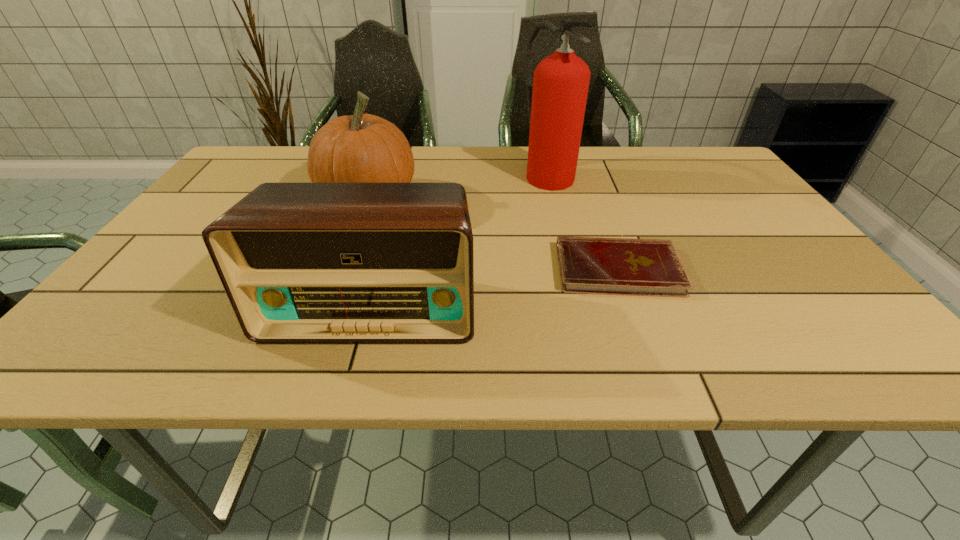
Locate an element on the screen. The image size is (960, 540). empty space that is in between the shortest object and the fire extinguisher is located at coordinates (583, 221).

Find the location of `free space between the shortest object and the tallest object`. free space between the shortest object and the tallest object is located at coordinates (583, 221).

You are a GUI agent. You are given a task and a screenshot of the screen. Output one action in this format:
    pyautogui.click(x=<x>, y=<y>)
    Task: Click on the closest object relative to the tallest object
    
    Given the screenshot: What is the action you would take?
    pyautogui.click(x=588, y=265)

Identify the location of object that ranks as the closest to the pumpkin. This screenshot has width=960, height=540. (300, 262).

Locate an element on the screen. Image resolution: width=960 pixels, height=540 pixels. vacant point that satisfies the following two spatial constraints: 1. on the stem of the pumpkin; 2. on the left side of the notebook is located at coordinates (344, 269).

Locate an element on the screen. The height and width of the screenshot is (540, 960). free space that satisfies the following two spatial constraints: 1. on the stem of the shortest object; 2. on the left side of the pumpkin is located at coordinates (344, 269).

You are a GUI agent. You are given a task and a screenshot of the screen. Output one action in this format:
    pyautogui.click(x=<x>, y=<y>)
    Task: Click on the free location that satisfies the following two spatial constraints: 1. on the handle side of the notebook; 2. on the right side of the fire extinguisher
    Image resolution: width=960 pixels, height=540 pixels.
    Given the screenshot: What is the action you would take?
    pyautogui.click(x=570, y=269)

Find the location of a particular element. This screenshot has height=540, width=960. free region that satisfies the following two spatial constraints: 1. on the stem of the shortest object; 2. on the left side of the pumpkin is located at coordinates (344, 269).

This screenshot has height=540, width=960. Find the location of `vacant area that satisfies the following two spatial constraints: 1. on the handle side of the tallest object; 2. on the stem of the pumpkin`. vacant area that satisfies the following two spatial constraints: 1. on the handle side of the tallest object; 2. on the stem of the pumpkin is located at coordinates (554, 200).